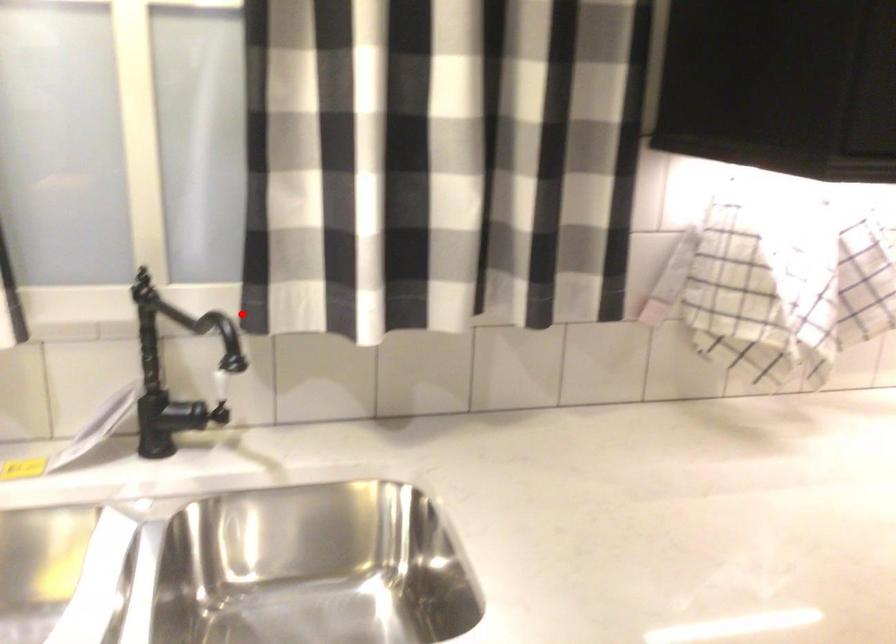
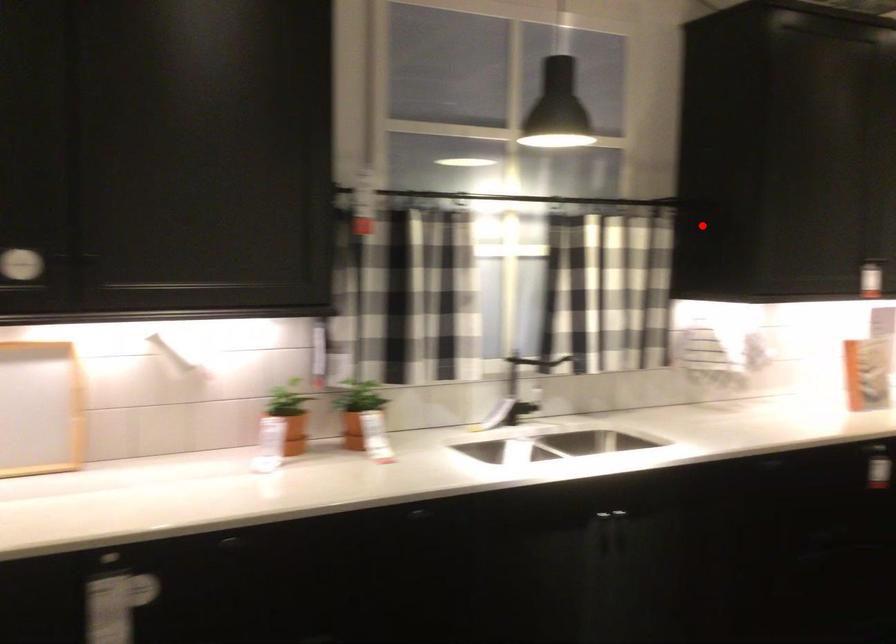
I am providing you with two images of the same scene from different viewpoints. A red point is marked on the first image and another point is marked on the second image. Is the marked point in image1 the same physical position as the marked point in image2?

No